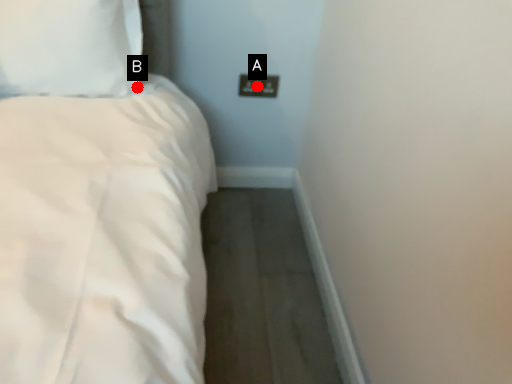
Question: Two points are circled on the image, labeled by A and B beside each circle. Which point appears farthest from the camera in this image?

Choices:
 (A) A is further
 (B) B is further

Answer: (A)